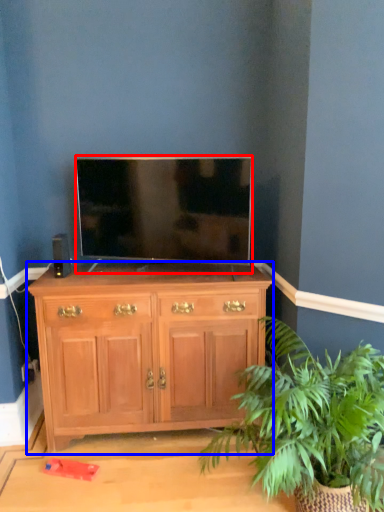
Question: Which point is further to the camera, television (highlighted by a red box) or chest of drawers (highlighted by a blue box)?

Choices:
 (A) television
 (B) chest of drawers

Answer: (B)